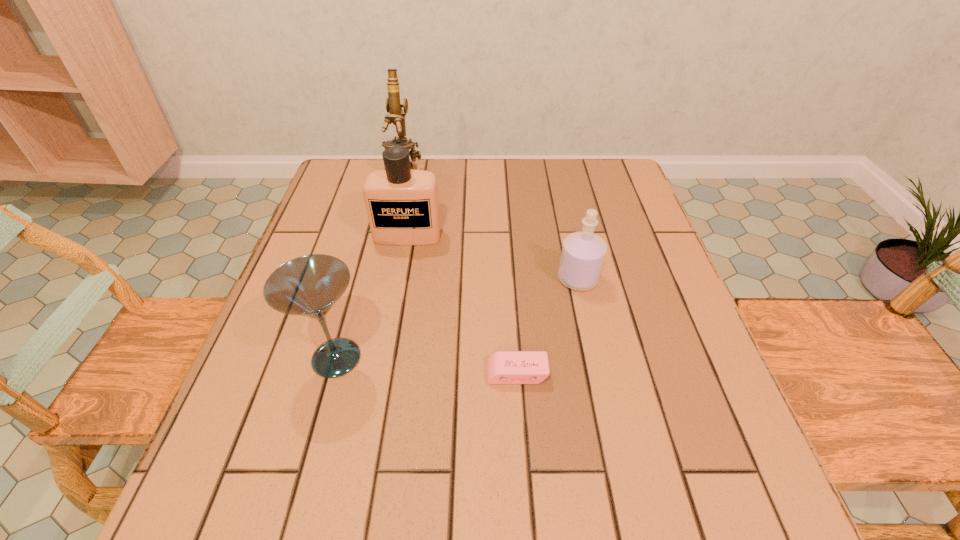
The image size is (960, 540). Find the location of `unoccupied area between the left perfume and the right perfume`. unoccupied area between the left perfume and the right perfume is located at coordinates (492, 257).

Find the location of a particular element. empty location between the fourth nearest object and the martini is located at coordinates [372, 296].

This screenshot has width=960, height=540. I want to click on free space between the martini and the microscope, so click(x=371, y=266).

Where is `empty space between the martini and the tallest object`? This screenshot has height=540, width=960. empty space between the martini and the tallest object is located at coordinates (371, 266).

Image resolution: width=960 pixels, height=540 pixels. Find the location of `free space between the farther perfume and the martini`. free space between the farther perfume and the martini is located at coordinates (372, 296).

Identify the location of unoccupied position between the farther perfume and the martini. The height and width of the screenshot is (540, 960). (372, 296).

Identify which object is the second nearest to the second farthest object. Please provide its 2D coordinates. Your answer should be formatted as a tuple, i.e. [(x, y)], where the tuple contains the x and y coordinates of a point satisfying the conditions above.

[(309, 286)]

Where is `object identified as the second closest to the martini`? This screenshot has height=540, width=960. object identified as the second closest to the martini is located at coordinates (402, 205).

Locate an element on the screen. vacant region that satisfies the following two spatial constraints: 1. on the front side of the farthest object; 2. on the right side of the eraser is located at coordinates (360, 373).

Identify the location of free space that satisfies the following two spatial constraints: 1. on the front side of the second object from right to left; 2. on the right side of the microscope. (360, 373).